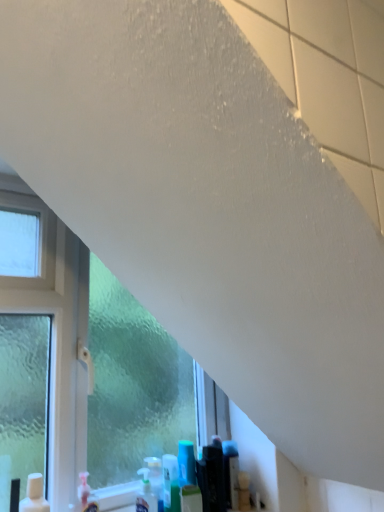
Question: In the image, is frosted glass window at left positioned in front of or behind translucent plastic spray bottle at lower center?

Choices:
 (A) front
 (B) behind

Answer: (A)

Question: Is frosted glass window at left to the left or to the right of translucent plastic spray bottle at lower center in the image?

Choices:
 (A) left
 (B) right

Answer: (A)

Question: Considering the positions of frosted glass window at left and translucent plastic spray bottle at lower center in the image, is frosted glass window at left taller or shorter than translucent plastic spray bottle at lower center?

Choices:
 (A) tall
 (B) short

Answer: (A)

Question: In terms of size, does translucent plastic spray bottle at lower center appear bigger or smaller than frosted glass window at left?

Choices:
 (A) big
 (B) small

Answer: (B)

Question: Is translucent plastic spray bottle at lower center inside the boundaries of frosted glass window at left, or outside?

Choices:
 (A) outside
 (B) inside

Answer: (B)

Question: Is point (137, 499) closer or farther from the camera than point (180, 421)?

Choices:
 (A) closer
 (B) farther

Answer: (A)

Question: Is translucent plastic spray bottle at lower center taller or shorter than frosted glass window at left?

Choices:
 (A) short
 (B) tall

Answer: (A)